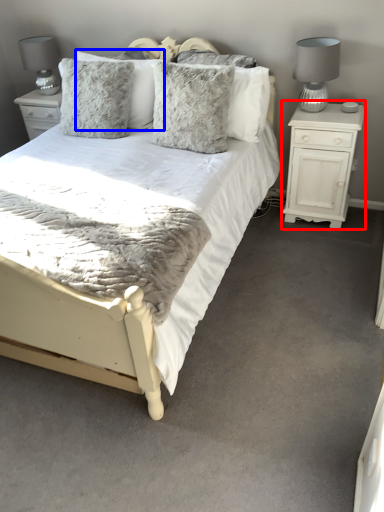
Question: Which object is further to the camera taking this photo, nightstand (highlighted by a red box) or pillow (highlighted by a blue box)?

Choices:
 (A) nightstand
 (B) pillow

Answer: (B)